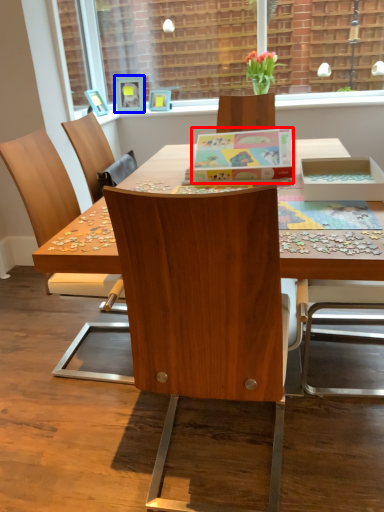
Question: Which of the following is the closest to the observer, box (highlighted by a red box) or picture frame (highlighted by a blue box)?

Choices:
 (A) box
 (B) picture frame

Answer: (A)